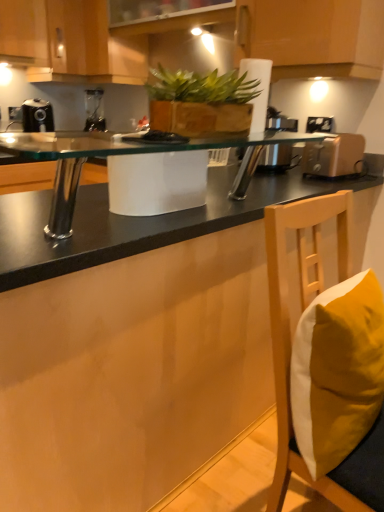
Describe the element at coordinates (291, 350) in the screenshot. The height and width of the screenshot is (512, 384). I see `velvet yellow pillow at lower right` at that location.

Locate an element on the screen. The image size is (384, 512). velvet yellow pillow at lower right is located at coordinates (291, 350).

From the image's perspective, is velvet yellow pillow at lower right located above black glass countertop at center?

No.

Which object is thinner, velvet yellow pillow at lower right or black glass countertop at center?

black glass countertop at center.

Identify the location of chair on the right of black glass countertop at center. The width and height of the screenshot is (384, 512). (291, 350).

From the picture: Considering the positions of objects velvet yellow pillow at lower right and black glass countertop at center in the image provided, who is in front, velvet yellow pillow at lower right or black glass countertop at center?

velvet yellow pillow at lower right is more forward.

Between metallic silver toaster at right and black glass countertop at center, which one appears on the right side from the viewer's perspective?

Positioned to the right is metallic silver toaster at right.

Based on the photo, is metallic silver toaster at right wider or thinner than black glass countertop at center?

Clearly, metallic silver toaster at right has more width compared to black glass countertop at center.

Where is `countertop that appears on the left of metallic silver toaster at right`? This screenshot has width=384, height=512. countertop that appears on the left of metallic silver toaster at right is located at coordinates (142, 221).

Is point (313, 146) less distant than point (161, 244)?

No, it is behind (161, 244).

Which object is closer to the camera, black glass countertop at center or matte wood cabinet at upper left, the 1th cabinetry from the left?

black glass countertop at center is more forward.

From the image's perspective, is black glass countertop at center above or below matte wood cabinet at upper left, the 1th cabinetry from the left?

From the image's perspective, black glass countertop at center appears below matte wood cabinet at upper left, the 1th cabinetry from the left.

Is black glass countertop at center taller than matte wood cabinet at upper left, the 1th cabinetry from the left?

No.

In terms of size, does black glass countertop at center appear bigger or smaller than matte wood cabinet at upper left, the 1th cabinetry from the left?

Considering their sizes, black glass countertop at center takes up less space than matte wood cabinet at upper left, the 1th cabinetry from the left.

Does matte wood cabinet at upper left, the 1th cabinetry from the left, have a larger size compared to velvet yellow pillow at lower right?

Yes, matte wood cabinet at upper left, the 1th cabinetry from the left, is bigger than velvet yellow pillow at lower right.

Is point (14, 4) positioned after point (288, 423)?

Yes, point (14, 4) is behind point (288, 423).

From the picture: Can you confirm if matte wood cabinet at upper left, the 3th cabinetry when ordered from right to left, is taller than velvet yellow pillow at lower right?

Indeed, matte wood cabinet at upper left, the 3th cabinetry when ordered from right to left, has a greater height compared to velvet yellow pillow at lower right.

In the scene shown: Based on their sizes in the image, would you say wooden cabinet at upper center, the first cabinetry positioned from the right, is bigger or smaller than white plastic electric outlet at upper right?

In the image, wooden cabinet at upper center, the first cabinetry positioned from the right, appears to be larger than white plastic electric outlet at upper right.

From the image's perspective, who appears lower, wooden cabinet at upper center, the first cabinetry positioned from the right, or white plastic electric outlet at upper right?

white plastic electric outlet at upper right is shown below in the image.

In the scene shown: Which point is more distant from viewer, (351, 53) or (329, 122)?

The point (329, 122) is farther.

Based on the photo, does wooden cabinet at upper center, acting as the third cabinetry starting from the left, have a lesser height compared to white plastic electric outlet at upper right?

No, wooden cabinet at upper center, acting as the third cabinetry starting from the left, is not shorter than white plastic electric outlet at upper right.

Is wooden cabinet at upper center, acting as the third cabinetry starting from the left, in front of or behind matte wood cabinet at upper left, the 1th cabinetry from the left, in the image?

Clearly, wooden cabinet at upper center, acting as the third cabinetry starting from the left, is in front of matte wood cabinet at upper left, the 1th cabinetry from the left.

Does wooden cabinet at upper center, acting as the third cabinetry starting from the left, have a greater width compared to matte wood cabinet at upper left, the 1th cabinetry from the left?

No.

Which point is more forward, (368, 46) or (31, 6)?

The point (368, 46) is more forward.

From the picture: Which object is positioned more to the left, wooden cabinet at upper center, the first cabinetry positioned from the right, or matte wood cabinet at upper left, the 3th cabinetry when ordered from right to left?

Positioned to the left is matte wood cabinet at upper left, the 3th cabinetry when ordered from right to left.

Is metallic silver toaster at right in front of or behind white plastic electric outlet at upper right in the image?

metallic silver toaster at right is positioned closer to the viewer than white plastic electric outlet at upper right.

In terms of height, does metallic silver toaster at right look taller or shorter compared to white plastic electric outlet at upper right?

In the image, metallic silver toaster at right appears to be taller than white plastic electric outlet at upper right.

Would you say white plastic electric outlet at upper right is part of metallic silver toaster at right's contents?

No, metallic silver toaster at right does not contain white plastic electric outlet at upper right.

Considering the sizes of objects metallic silver toaster at right and white plastic electric outlet at upper right in the image provided, who is wider, metallic silver toaster at right or white plastic electric outlet at upper right?

metallic silver toaster at right is wider.

Find the location of a particular element. The width and height of the screenshot is (384, 512). countertop above the velvet yellow pillow at lower right (from a real-world perspective) is located at coordinates (142, 221).

At what (x,y) coordinates should I click in order to perform the action: click on appliance lying on the right of black glass countertop at center. Please return your answer as a coordinate pair (x, y). The image size is (384, 512). Looking at the image, I should click on (334, 156).

When comparing their distances from wooden cabinet at upper center, the first cabinetry positioned from the right, does black glass countertop at center or velvet yellow pillow at lower right seem closer?

black glass countertop at center.

Based on their spatial positions, is wooden cabinet at upper center, acting as the third cabinetry starting from the left, or wooden cabinet at upper center, positioned as the second cabinetry in right-to-left order, further from green leafy plant at center?

Among the two, wooden cabinet at upper center, positioned as the second cabinetry in right-to-left order, is located further to green leafy plant at center.

Which object lies further to the anchor point velvet yellow pillow at lower right, wooden cabinet at upper center, the first cabinetry positioned from the right, or metallic silver toaster at right?

wooden cabinet at upper center, the first cabinetry positioned from the right.

From the picture: Considering their positions, is matte wood cabinet at upper left, the 1th cabinetry from the left, positioned closer to metallic silver toaster at right than velvet yellow pillow at lower right?

The object closer to metallic silver toaster at right is velvet yellow pillow at lower right.

When comparing their distances from black plastic coffee machine at left, does white plastic electric outlet at upper right or green leafy plant at center seem further?

Based on the image, white plastic electric outlet at upper right appears to be further to black plastic coffee machine at left.

Which object lies nearer to the anchor point white plastic electric outlet at upper right, green leafy plant at center or metallic silver toaster at right?

Based on the image, metallic silver toaster at right appears to be nearer to white plastic electric outlet at upper right.

Looking at the image, which one is located closer to green leafy plant at center, wooden cabinet at upper center, positioned as the second cabinetry in right-to-left order, or matte wood cabinet at upper left, the 3th cabinetry when ordered from right to left?

wooden cabinet at upper center, positioned as the second cabinetry in right-to-left order, lies closer to green leafy plant at center than the other object.

From the image, which object appears to be nearer to wooden cabinet at upper center, acting as the third cabinetry starting from the left, metallic silver toaster at right or green leafy plant at center?

Among the two, metallic silver toaster at right is located nearer to wooden cabinet at upper center, acting as the third cabinetry starting from the left.

Where is `cabinetry between wooden cabinet at upper center, positioned as the second cabinetry in right-to-left order, and metallic silver toaster at right`? This screenshot has width=384, height=512. cabinetry between wooden cabinet at upper center, positioned as the second cabinetry in right-to-left order, and metallic silver toaster at right is located at coordinates (313, 37).

This screenshot has height=512, width=384. In order to click on countertop between wooden cabinet at upper center, the first cabinetry positioned from the right, and velvet yellow pillow at lower right in the up-down direction in this screenshot , I will do `click(142, 221)`.

Image resolution: width=384 pixels, height=512 pixels. What are the coordinates of `chair located between matte wood cabinet at upper left, the 1th cabinetry from the left, and metallic silver toaster at right in the left-right direction` in the screenshot? It's located at (291, 350).

Locate an element on the screen. Image resolution: width=384 pixels, height=512 pixels. countertop between velvet yellow pillow at lower right and metallic silver toaster at right from front to back is located at coordinates (142, 221).